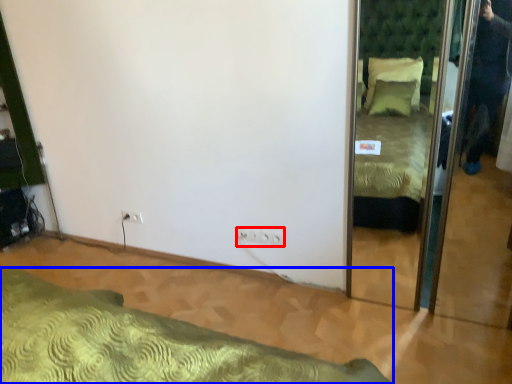
Question: Which object appears farthest to the camera in this image, electric outlet (highlighted by a red box) or bed (highlighted by a blue box)?

Choices:
 (A) electric outlet
 (B) bed

Answer: (A)